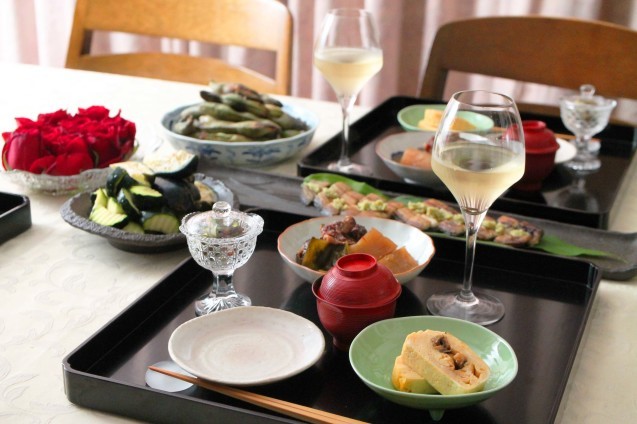
Locate an element on the screen. trays is located at coordinates (569, 333), (617, 169), (4, 202).